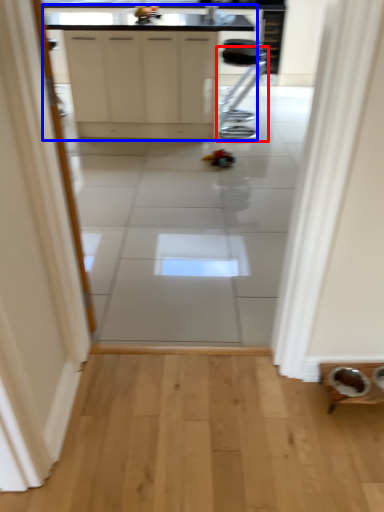
Question: Which object is further to the camera taking this photo, furniture (highlighted by a red box) or cabinetry (highlighted by a blue box)?

Choices:
 (A) furniture
 (B) cabinetry

Answer: (A)